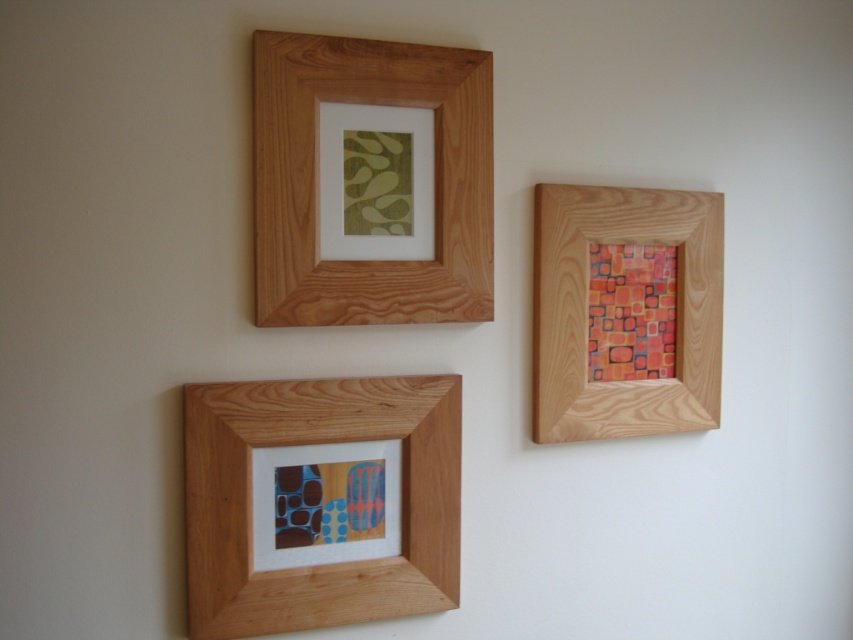
You are an interior designer assessing the wall layout. The wooden frame at upper left and the multicolored painted squares at upper right are both on the same wall. Which of these two objects takes up more space on the wall?

The wooden frame at upper left is larger in size than the multicolored painted squares at upper right, so it takes up more space on the wall.

You are an interior designer assessing wall spacing. You have two artworks to hang on a wall with limited vertical space. The wooden frame at upper left and the multicolored painted squares at upper right are options. Based on their sizes, which artwork would require less vertical space?

The wooden frame at upper left is much taller than the multicolored painted squares at upper right, so the multicolored painted squares at upper right would require less vertical space.

You are an interior designer assessing the wall layout. You need to determine if the wooden frame at upper right can be placed above the wooden frame at upper center without overlapping. Can it fit vertically?

The wooden frame at upper right has a greater height compared to the wooden frame at upper center. Since it is taller, placing it above might require more vertical space. However, without knowing the exact spacing between the frames or the total available wall height, it is impossible to definitively determine if it can fit without overlapping. Additional measurements are needed.